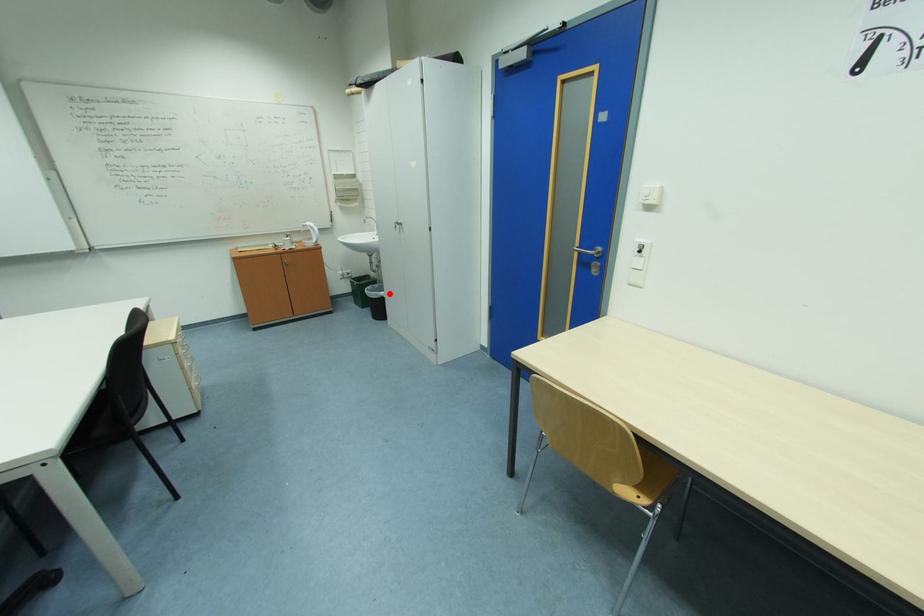
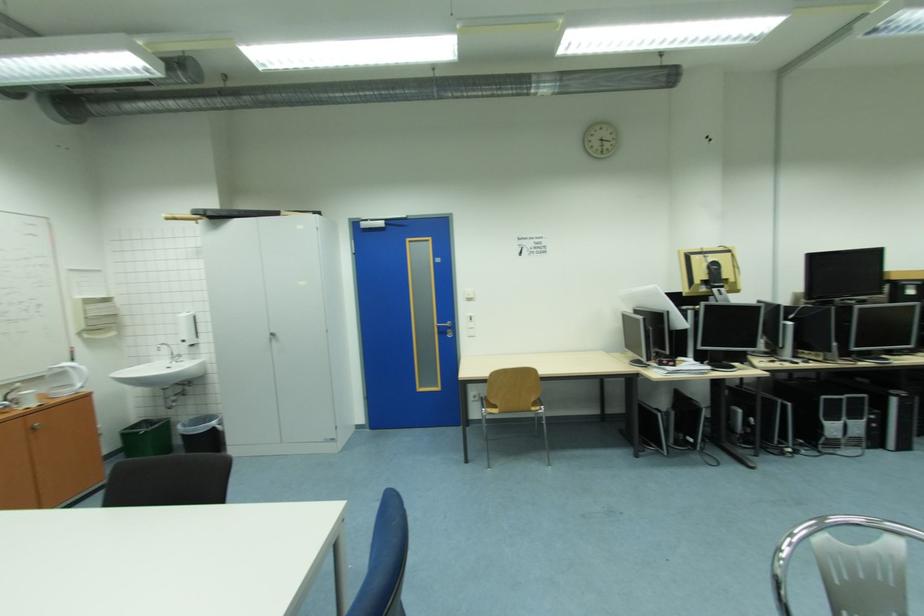
In the second image, find the point that corresponds to the highlighted location in the first image.

(220, 424)